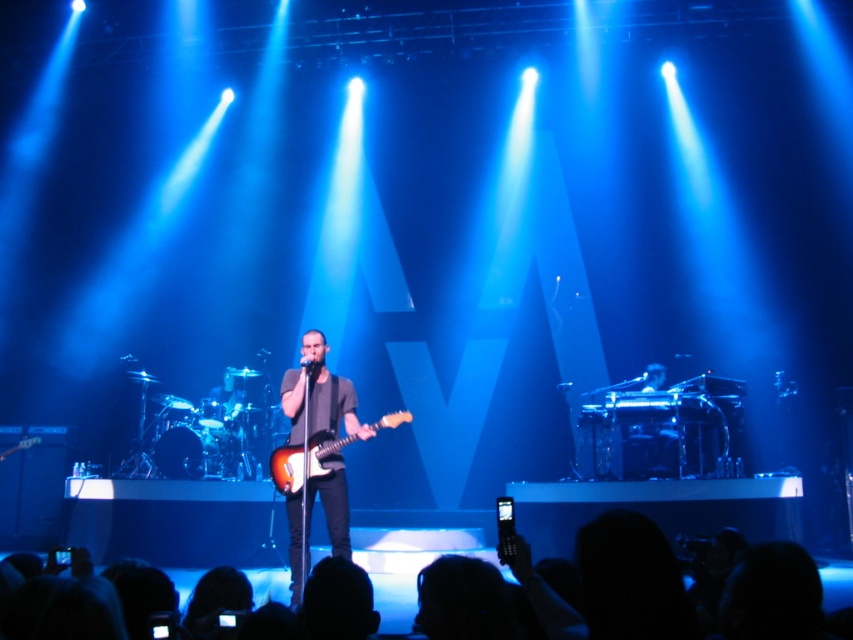
You are a photographer at the concert. You want to take a photo focusing on the satin black guitar at center and the sunburst wood electric guitar at center. Which guitar will appear larger in the photo?

The satin black guitar at center will appear larger in the photo because it is closer to the viewer than the sunburst wood electric guitar at center.

You are a photographer at the concert. You want to capture a closeup of the performer without the satin black guitar at center blocking the silhouette hair at lower center. Is it possible to adjust your angle to achieve this?

The satin black guitar at center is positioned over silhouette hair at lower center, so adjusting the angle might allow you to capture the silhouette hair at lower center without the guitar blocking it by moving slightly to the side or adjusting the camera angle upward.

Looking at this image, you are a stagehand who needs to adjust the microphone stand between the satin black guitar at center and the sunburst wood electric guitar at center. Which guitar should you place the microphone stand closer to, based on their vertical positions?

The satin black guitar at center is located below the sunburst wood electric guitar at center, so the microphone stand should be placed closer to the satin black guitar at center to accommodate its lower position.